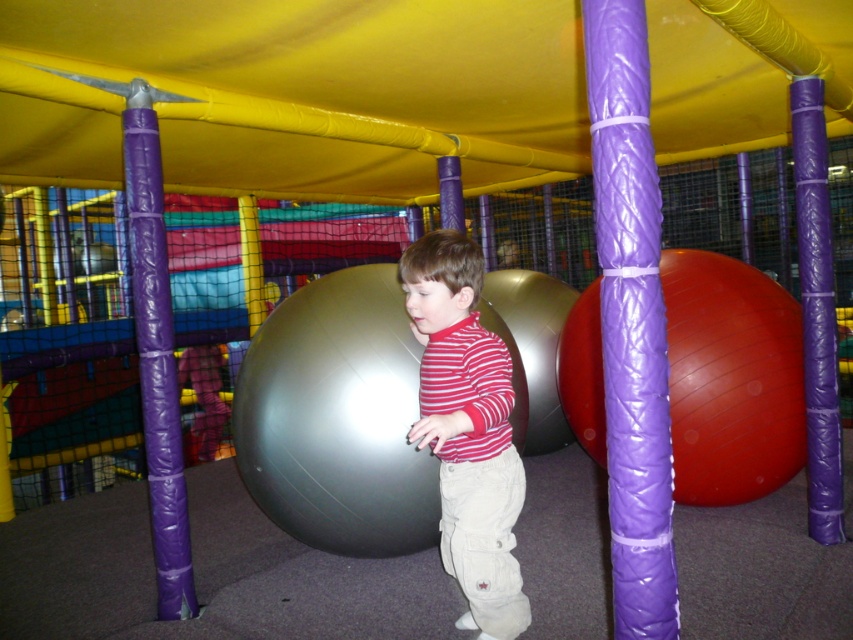
You are a parent in the play area and want to give your child a metallic gray ball at center. However, you notice another child has a striped cotton shirt at center. Which item is bigger?

The metallic gray ball at center is larger in size compared to the striped cotton shirt at center.

You are navigating through the indoor play area and need to reach the point marked as point (593, 198). You are currently at point (410, 291). Considering the play area has obstacles like padded structures, which direction should you move to get closer to your destination?

Since point (593, 198) is further to the viewer than point (410, 291), you should move forward towards the destination to get closer.

You are a parent trying to locate your child in the play area. You see the purple quilted pole at center and the striped cotton shirt at center. Which object is to the right of the other?

The purple quilted pole at center is positioned on the right side of striped cotton shirt at center.